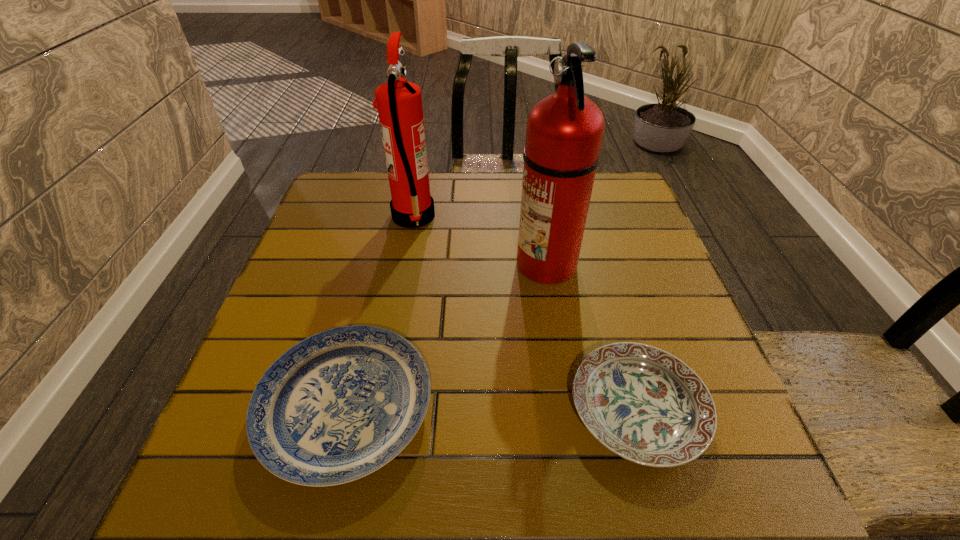
Where is `empty space between the right fire extinguisher and the third shortest object`? Image resolution: width=960 pixels, height=540 pixels. empty space between the right fire extinguisher and the third shortest object is located at coordinates (480, 240).

Select which object is the second closest to the right fire extinguisher. Please provide its 2D coordinates. Your answer should be formatted as a tuple, i.e. [(x, y)], where the tuple contains the x and y coordinates of a point satisfying the conditions above.

[(337, 406)]

Locate an element on the screen. The width and height of the screenshot is (960, 540). object that is the third closest to the second tallest object is located at coordinates (642, 403).

Find the location of a particular element. free region that satisfies the following two spatial constraints: 1. with the nozzle aimed from the second tallest object; 2. on the front side of the left plate is located at coordinates (378, 408).

Locate an element on the screen. The image size is (960, 540). vacant region that satisfies the following two spatial constraints: 1. with the nozzle aimed from the left fire extinguisher; 2. on the back side of the right plate is located at coordinates (378, 410).

At what (x,y) coordinates should I click in order to perform the action: click on vacant space that satisfies the following two spatial constraints: 1. at the nozzle of the right fire extinguisher; 2. on the back side of the right plate. Please return your answer as a coordinate pair (x, y). Looking at the image, I should click on click(570, 410).

The width and height of the screenshot is (960, 540). What are the coordinates of `free space that satisfies the following two spatial constraints: 1. with the nozzle aimed from the left fire extinguisher; 2. on the left side of the right plate` in the screenshot? It's located at (378, 410).

Identify the location of free space that satisfies the following two spatial constraints: 1. with the nozzle aimed from the shorter fire extinguisher; 2. on the left side of the right plate. (378, 410).

I want to click on free space that satisfies the following two spatial constraints: 1. on the back side of the right plate; 2. with the nozzle aimed from the shorter fire extinguisher, so click(583, 217).

This screenshot has width=960, height=540. Identify the location of free space that satisfies the following two spatial constraints: 1. on the back side of the right plate; 2. with the nozzle aimed from the shorter fire extinguisher. (583, 217).